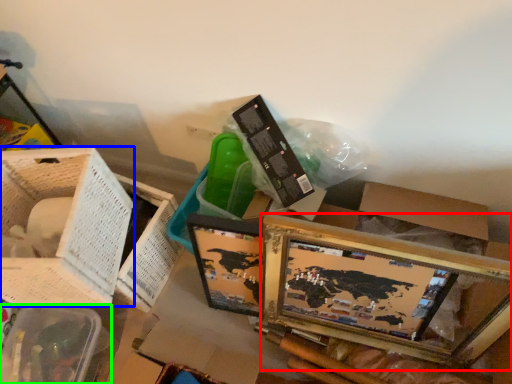
Question: Which object is positioned farthest from picture frame (highlighted by a red box)? Select from basket (highlighted by a blue box) and basket (highlighted by a green box).

Choices:
 (A) basket
 (B) basket

Answer: (B)